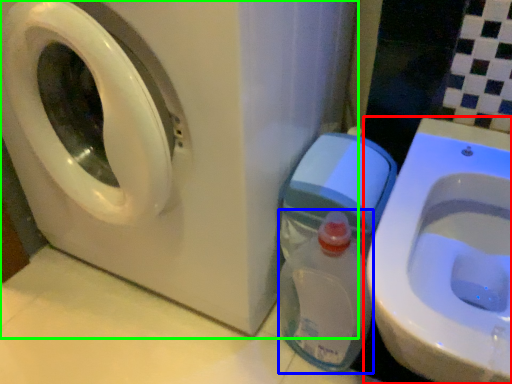
Question: Considering the real-world distances, which object is farthest from toilet (highlighted by a red box)? baby bottle (highlighted by a blue box) or washing machine (highlighted by a green box)?

Choices:
 (A) baby bottle
 (B) washing machine

Answer: (B)